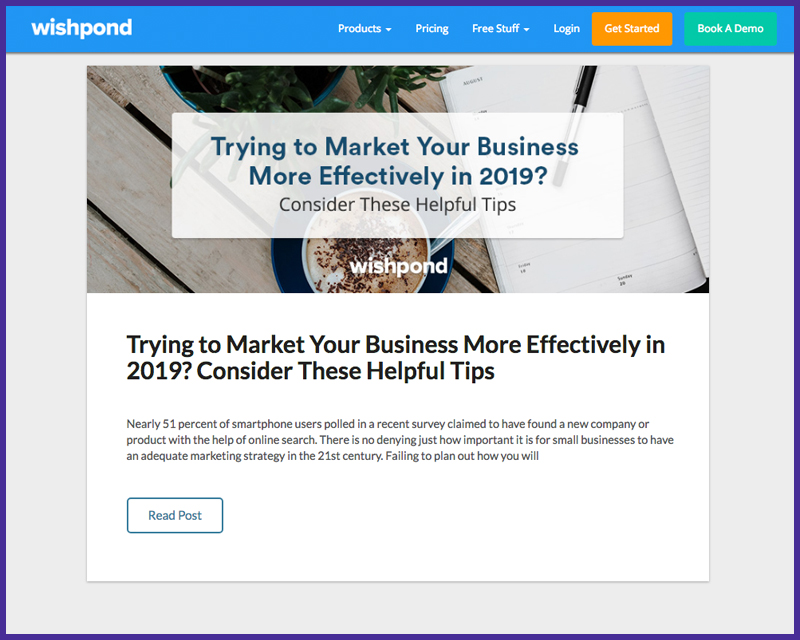
The height and width of the screenshot is (640, 800). Find the location of `plant`. plant is located at coordinates (258, 80).